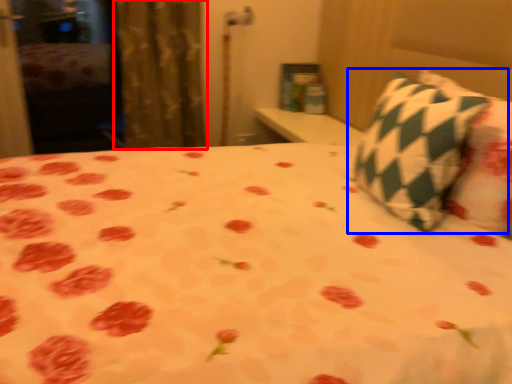
Question: Which of the following is the closest to the observer, curtain (highlighted by a red box) or pillow (highlighted by a blue box)?

Choices:
 (A) curtain
 (B) pillow

Answer: (B)